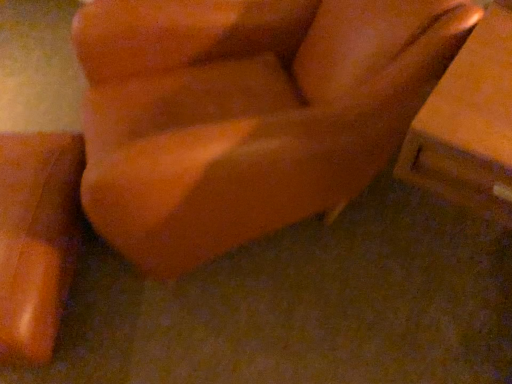
Question: From the image's perspective, would you say matte orange vase at lower left, which ranks as the second furniture in right-to-left order, is shown under matte orange chair at center, acting as the 2th furniture starting from the left?

Choices:
 (A) no
 (B) yes

Answer: (B)

Question: Is matte orange vase at lower left, the first furniture in the left-to-right sequence, closer to the viewer compared to matte orange chair at center, acting as the 2th furniture starting from the left?

Choices:
 (A) yes
 (B) no

Answer: (B)

Question: Is matte orange vase at lower left, the first furniture in the left-to-right sequence, smaller than matte orange chair at center, acting as the 2th furniture starting from the left?

Choices:
 (A) yes
 (B) no

Answer: (A)

Question: Is matte orange vase at lower left, the first furniture in the left-to-right sequence, further to camera compared to matte orange chair at center, acting as the 2th furniture starting from the left?

Choices:
 (A) yes
 (B) no

Answer: (A)

Question: Does matte orange vase at lower left, the first furniture in the left-to-right sequence, turn towards matte orange chair at center, marked as the first furniture in a right-to-left arrangement?

Choices:
 (A) yes
 (B) no

Answer: (B)

Question: Is matte orange vase at lower left, which ranks as the second furniture in right-to-left order, to the left of matte orange chair at center, marked as the first furniture in a right-to-left arrangement, from the viewer's perspective?

Choices:
 (A) no
 (B) yes

Answer: (B)

Question: Can you confirm if matte orange chair at center, acting as the 2th furniture starting from the left, is thinner than matte orange vase at lower left, the first furniture in the left-to-right sequence?

Choices:
 (A) yes
 (B) no

Answer: (B)

Question: Is matte orange chair at center, acting as the 2th furniture starting from the left, positioned beyond the bounds of matte orange vase at lower left, the first furniture in the left-to-right sequence?

Choices:
 (A) yes
 (B) no

Answer: (A)

Question: Does matte orange chair at center, marked as the first furniture in a right-to-left arrangement, have a greater height compared to matte orange vase at lower left, the first furniture in the left-to-right sequence?

Choices:
 (A) yes
 (B) no

Answer: (A)

Question: From the image's perspective, is matte orange chair at center, marked as the first furniture in a right-to-left arrangement, on top of matte orange vase at lower left, which ranks as the second furniture in right-to-left order?

Choices:
 (A) yes
 (B) no

Answer: (A)

Question: Considering the relative sizes of matte orange chair at center, marked as the first furniture in a right-to-left arrangement, and matte orange vase at lower left, the first furniture in the left-to-right sequence, in the image provided, is matte orange chair at center, marked as the first furniture in a right-to-left arrangement, shorter than matte orange vase at lower left, the first furniture in the left-to-right sequence,?

Choices:
 (A) no
 (B) yes

Answer: (A)

Question: From the image's perspective, is matte orange chair at center, acting as the 2th furniture starting from the left, under matte orange vase at lower left, which ranks as the second furniture in right-to-left order?

Choices:
 (A) no
 (B) yes

Answer: (A)

Question: Considering the positions of matte orange chair at center, acting as the 2th furniture starting from the left, and matte orange vase at lower left, the first furniture in the left-to-right sequence, in the image, is matte orange chair at center, acting as the 2th furniture starting from the left, wider or thinner than matte orange vase at lower left, the first furniture in the left-to-right sequence,?

Choices:
 (A) wide
 (B) thin

Answer: (A)